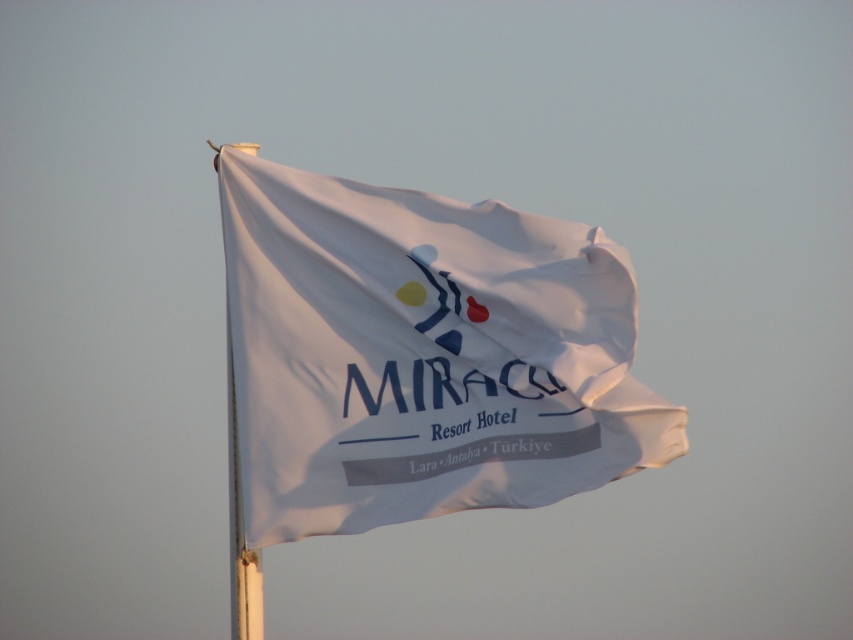
Between point (618, 376) and point (231, 465), which one is positioned in front?

Point (618, 376) is more forward.

Does white fabric flag at center appear on the right side of white fabric flagpole at left?

Indeed, white fabric flag at center is positioned on the right side of white fabric flagpole at left.

Find the location of `white fabric flag at center`. white fabric flag at center is located at coordinates (422, 355).

I want to click on white fabric flag at center, so click(x=422, y=355).